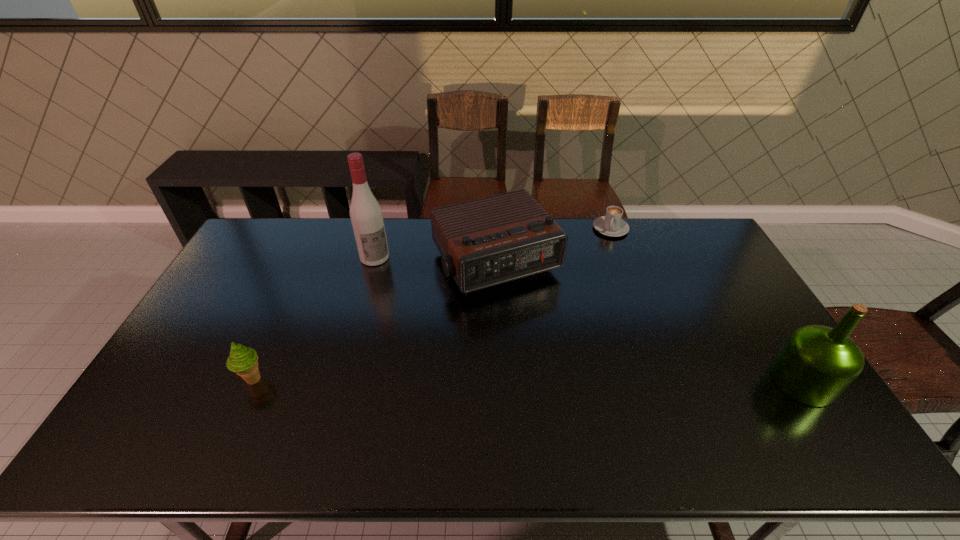
You are a GUI agent. You are given a task and a screenshot of the screen. Output one action in this format:
    pyautogui.click(x=<x>, y=<y>)
    Task: Click on the vacant space situated on the left of the fourth tallest object
    This screenshot has height=540, width=960.
    Given the screenshot: What is the action you would take?
    pyautogui.click(x=198, y=380)

I want to click on free spot located 0.230m on the left of the fourth shortest object, so click(686, 381).

At what (x,y) coordinates should I click in order to perform the action: click on vacant space situated on the label of the alcohol. Please return your answer as a coordinate pair (x, y). The height and width of the screenshot is (540, 960). Looking at the image, I should click on (406, 307).

The image size is (960, 540). What are the coordinates of `free space located on the label of the alcohol` in the screenshot? It's located at (420, 330).

You are a GUI agent. You are given a task and a screenshot of the screen. Output one action in this format:
    pyautogui.click(x=<x>, y=<y>)
    Task: Click on the vacant space located on the label of the alcohol
    The height and width of the screenshot is (540, 960).
    Given the screenshot: What is the action you would take?
    pyautogui.click(x=407, y=309)

This screenshot has height=540, width=960. Find the location of `vacant region located 0.160m on the front panel of the third tallest object`. vacant region located 0.160m on the front panel of the third tallest object is located at coordinates (548, 336).

The image size is (960, 540). Find the location of `free space located on the front panel of the third tallest object`. free space located on the front panel of the third tallest object is located at coordinates (587, 393).

At what (x,y) coordinates should I click in order to perform the action: click on vacant space located on the front panel of the third tallest object. Please return your answer as a coordinate pair (x, y). The height and width of the screenshot is (540, 960). Looking at the image, I should click on (543, 328).

Identify the location of free space located to the right of the shortest object. (598, 267).

Find the location of a particular element. Image resolution: width=960 pixels, height=540 pixels. vacant space situated to the right of the shortest object is located at coordinates (594, 282).